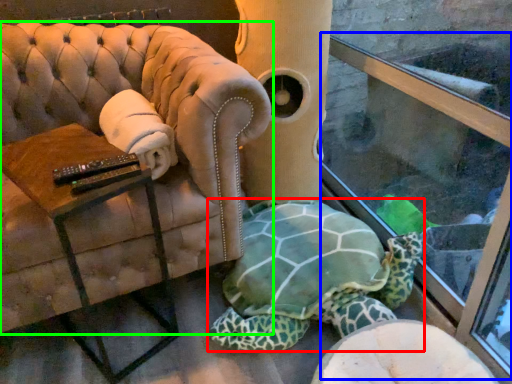
Question: Which object is the farthest from tortoise (highlighted by a red box)? Choose among these: shop window (highlighted by a blue box) or chair (highlighted by a green box).

Choices:
 (A) shop window
 (B) chair

Answer: (B)